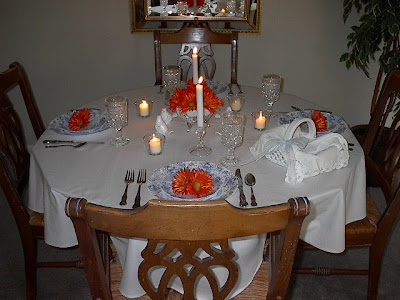
Where is `chair`? The width and height of the screenshot is (400, 300). chair is located at coordinates (213, 221), (15, 78), (190, 33), (388, 89).